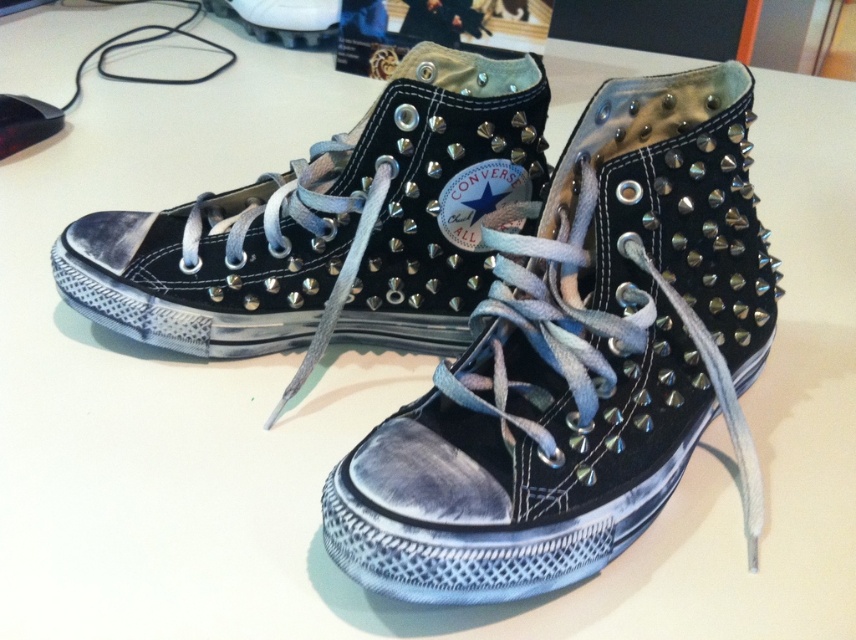
You are trying to decide which pair of sneakers to wear for a casual evening out. You have two options in front of you, the black leather converse at center and the matte black sneakers at center. Based on their height, which one would you choose if you want something that covers more of your ankle?

The black leather converse at center is taller than the matte black sneakers at center, so it would cover more of your ankle and be the better choice for a casual evening out.

From the picture: You are trying to decide between two pairs of sneakers displayed in a store window. You have a specific width requirement for comfort. Given that the black leather converse at center and the matte black sneakers at center are both at the center of your view, which pair should you choose if you need a wider option?

The matte black sneakers at center are wider than the black leather converse at center, so you should choose the matte black sneakers at center for a wider option.

You are a shoemaker who wants to place a decorative ribbon between the black leather converse at center and the matte black sneakers at center. The ribbon is 10 inches long. Will the ribbon be long enough to span the gap between them?

The distance between the black leather converse at center and the matte black sneakers at center is 10.96 inches. Since the ribbon is only 10 inches long, it is not long enough to span the gap between them.